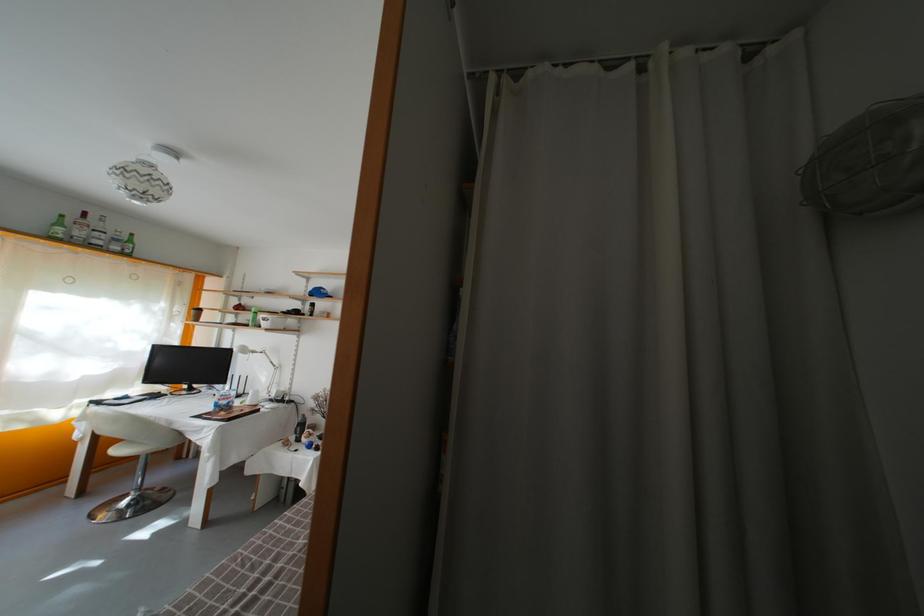
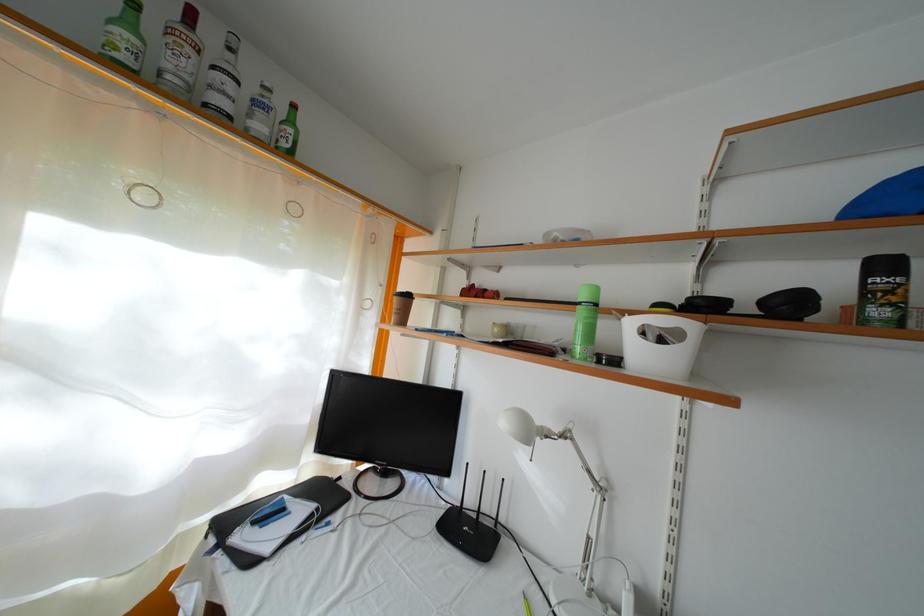
Where in the second image is the point corresponding to (x=67, y=230) from the first image?

(134, 31)